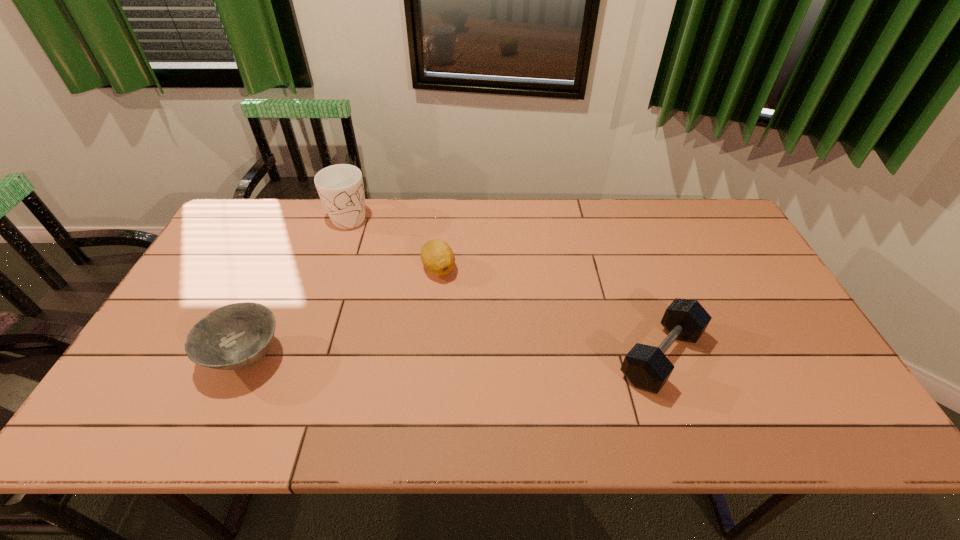
Locate an element on the screen. This screenshot has height=540, width=960. free space located 0.050m at the stem end of the second farthest object is located at coordinates (438, 296).

What are the coordinates of `free location located 0.170m on the side of the tallest object with the handle` in the screenshot? It's located at (368, 265).

Where is `vacant space located on the side of the tallest object with the handle`? vacant space located on the side of the tallest object with the handle is located at coordinates (358, 241).

Image resolution: width=960 pixels, height=540 pixels. Find the location of `blank space located on the side of the tallest object with the handle`. blank space located on the side of the tallest object with the handle is located at coordinates pos(385,305).

Where is `object present at the far edge`? object present at the far edge is located at coordinates (340, 187).

This screenshot has width=960, height=540. I want to click on bowl situated at the near edge, so click(x=236, y=336).

Where is `dumbbell present at the near edge`? This screenshot has width=960, height=540. dumbbell present at the near edge is located at coordinates (646, 367).

Image resolution: width=960 pixels, height=540 pixels. I want to click on object at the left edge, so click(236, 336).

Where is `object that is at the near left corner`? Image resolution: width=960 pixels, height=540 pixels. object that is at the near left corner is located at coordinates (236, 336).

You are a GUI agent. You are given a task and a screenshot of the screen. Output one action in this format:
    pyautogui.click(x=<x>, y=<y>)
    Task: Click on the free space at the far edge of the desktop
    Image resolution: width=960 pixels, height=540 pixels.
    Given the screenshot: What is the action you would take?
    point(404,210)